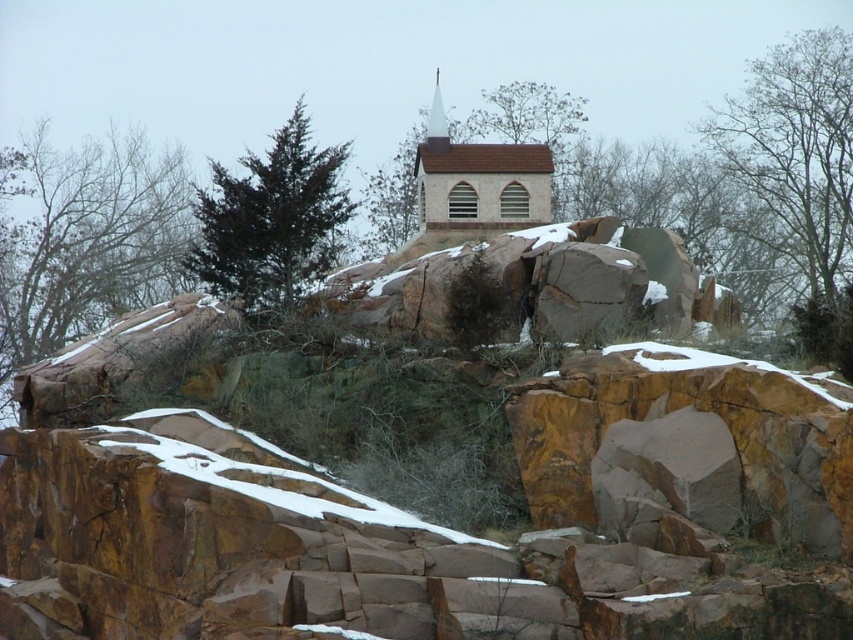
You are standing at the base of the green leafy tree at upper left and want to walk to the smooth brown church steeple at center. Which direction should you head to get closer to the steeple?

You should head towards the center to get closer to the smooth brown church steeple at center, as it is located at the center of the image while the green leafy tree at upper left is positioned at the upper left.